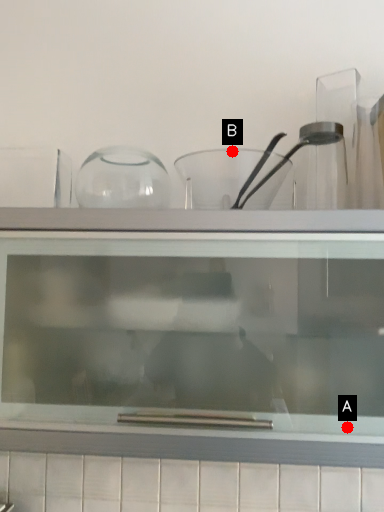
Question: Two points are circled on the image, labeled by A and B beside each circle. Which point appears farthest from the camera in this image?

Choices:
 (A) A is further
 (B) B is further

Answer: (B)